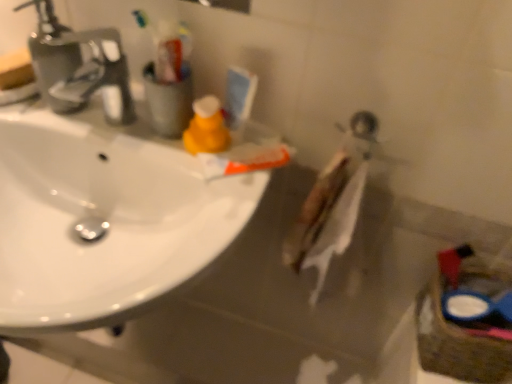
The height and width of the screenshot is (384, 512). Identify the location of free space in front of matte orange spray bottle at upper center. (219, 203).